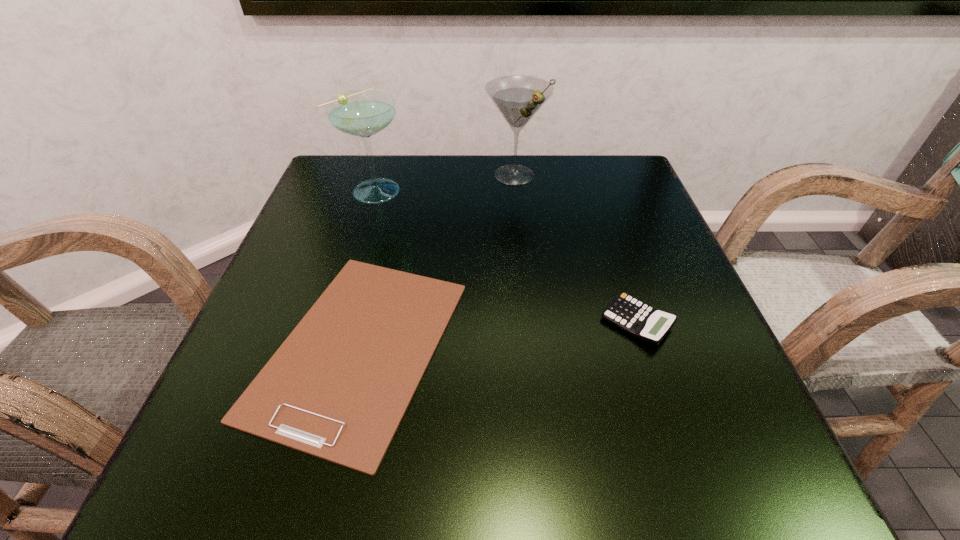
Identify the location of martini at the left edge. (363, 113).

At what (x,y) coordinates should I click in order to perform the action: click on clipboard present at the left edge. Please return your answer as a coordinate pair (x, y). Image resolution: width=960 pixels, height=540 pixels. Looking at the image, I should click on (338, 387).

Where is `object situated at the right edge`? The width and height of the screenshot is (960, 540). object situated at the right edge is located at coordinates (642, 321).

I want to click on object at the far left corner, so click(363, 113).

Identify the location of object that is at the near left corner. (x=338, y=387).

This screenshot has height=540, width=960. Identify the location of vacant space at the far edge of the desktop. (509, 195).

At what (x,y) coordinates should I click in order to perform the action: click on free location at the near edge. Please return your answer as a coordinate pair (x, y). The width and height of the screenshot is (960, 540). Looking at the image, I should click on (329, 478).

Locate an element on the screen. This screenshot has height=540, width=960. free region at the left edge of the desktop is located at coordinates (274, 289).

Where is `free space at the right edge of the desktop`? This screenshot has height=540, width=960. free space at the right edge of the desktop is located at coordinates (686, 369).

Image resolution: width=960 pixels, height=540 pixels. In order to click on vacant space at the near left corner in this screenshot , I will do `click(232, 430)`.